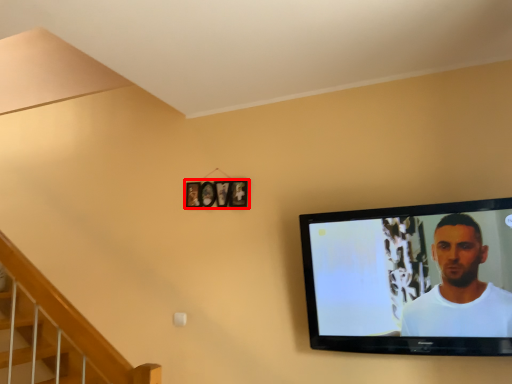
Question: Observing the image, what is the correct spatial positioning of picture frame (annotated by the red box) in reference to television?

Choices:
 (A) right
 (B) left

Answer: (B)